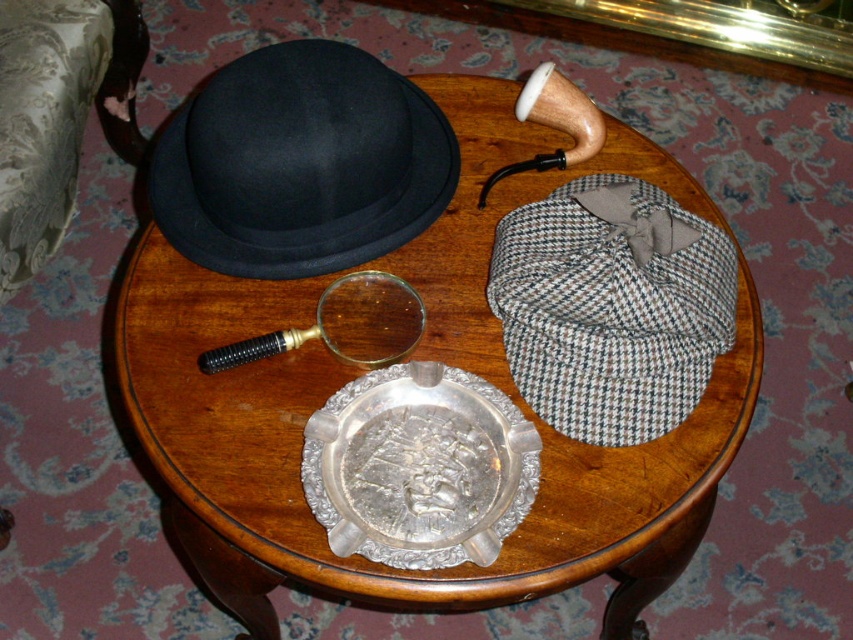
Question: Can you confirm if black felt fedora at upper left is positioned to the right of silver metallic tray at center?

Choices:
 (A) no
 (B) yes

Answer: (A)

Question: Does wooden round table at center appear on the right side of houndstooth wool cap at upper right?

Choices:
 (A) no
 (B) yes

Answer: (A)

Question: Which object appears closest to the camera in this image?

Choices:
 (A) silver metallic tray at center
 (B) gold-toned glass magnifying glass at center

Answer: (A)

Question: Is wooden round table at center bigger than silver metallic tray at center?

Choices:
 (A) yes
 (B) no

Answer: (A)

Question: Among these points, which one is farthest from the camera?

Choices:
 (A) (321, 328)
 (B) (515, 156)
 (C) (691, 289)
 (D) (405, 401)

Answer: (B)

Question: Which point is closer to the camera?

Choices:
 (A) houndstooth wool cap at upper right
 (B) wooden round table at center
 (C) black felt fedora at upper left

Answer: (B)